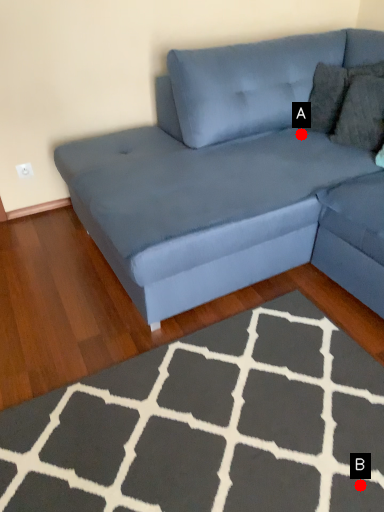
Question: Two points are circled on the image, labeled by A and B beside each circle. Which point appears farthest from the camera in this image?

Choices:
 (A) A is further
 (B) B is further

Answer: (A)